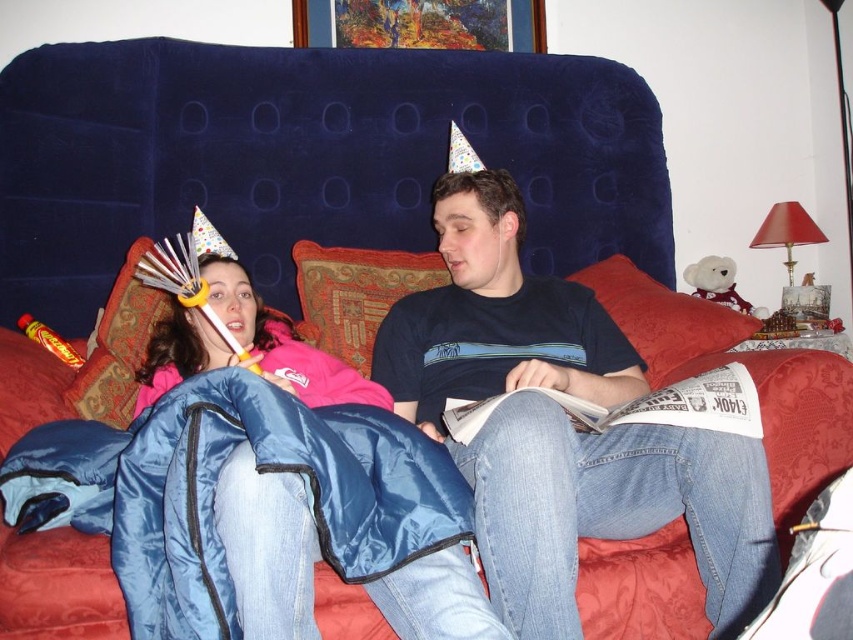
Question: Is the position of blue quilted sleeping bag at left less distant than that of blue synthetic sleeping bag at lower left?

Choices:
 (A) no
 (B) yes

Answer: (A)

Question: Considering the relative positions of blue quilted sleeping bag at left and blue synthetic sleeping bag at lower left in the image provided, where is blue quilted sleeping bag at left located with respect to blue synthetic sleeping bag at lower left?

Choices:
 (A) above
 (B) below

Answer: (A)

Question: Which point is closer to the camera?

Choices:
 (A) blue quilted sleeping bag at left
 (B) blue synthetic sleeping bag at lower left

Answer: (B)

Question: Is blue quilted sleeping bag at left bigger than blue synthetic sleeping bag at lower left?

Choices:
 (A) yes
 (B) no

Answer: (A)

Question: Which point is farther to the camera?

Choices:
 (A) blue quilted sleeping bag at left
 (B) blue synthetic sleeping bag at lower left

Answer: (A)